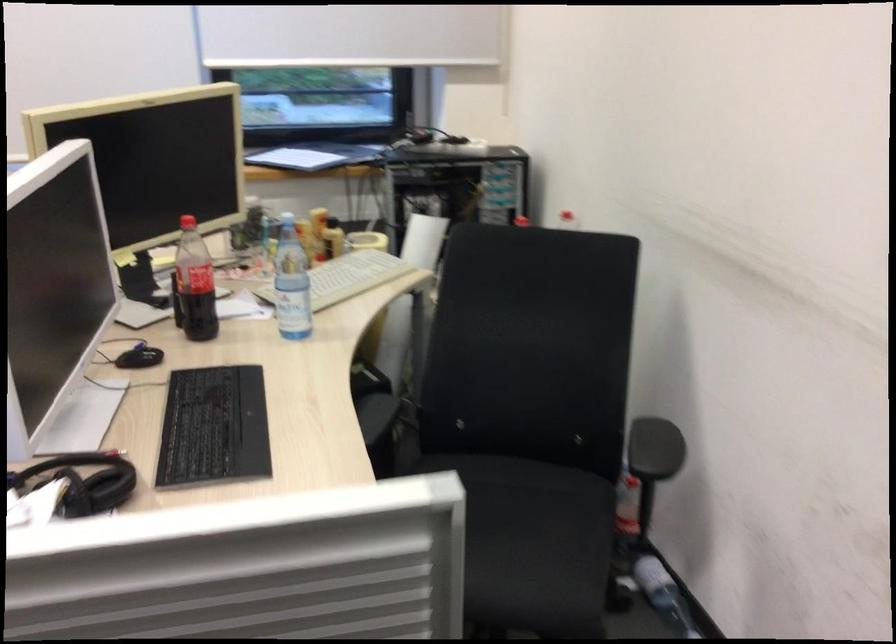
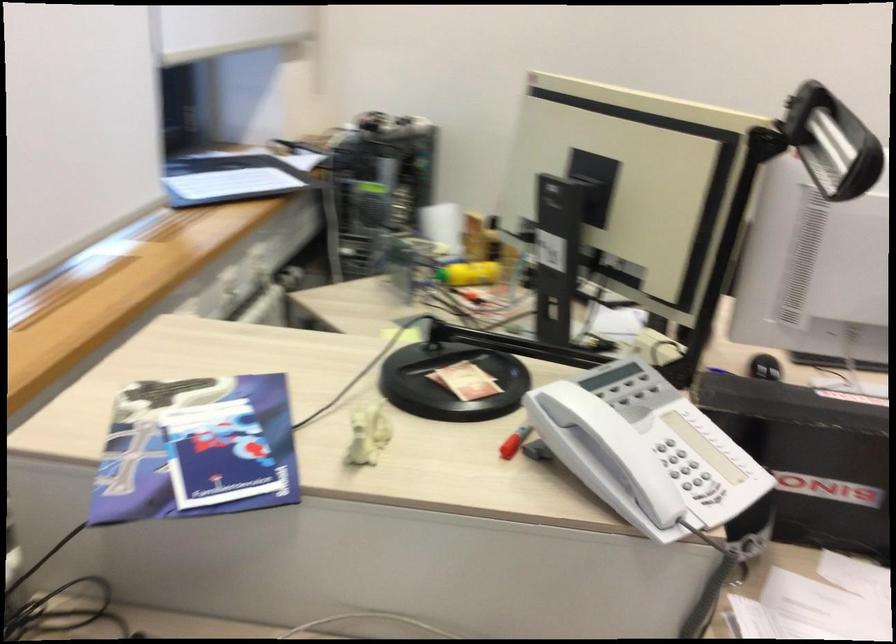
Question: I am providing you with two images of the same scene from different viewpoints. After the viewpoint changes to image2, which objects are now occluded?

Choices:
 (A) Union Jack pillow
 (B) white phone handset
 (C) small white figurine
 (D) beige keyboard

Answer: (D)